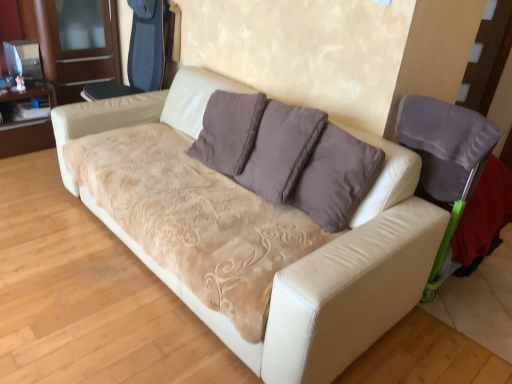
Question: From a real-world perspective, is brushed wood dresser at left over velvet purple armchair at right, which is the second armchair in back-to-front order?

Choices:
 (A) no
 (B) yes

Answer: (B)

Question: Can you confirm if brushed wood dresser at left is taller than velvet purple armchair at right, the first armchair viewed from the front?

Choices:
 (A) yes
 (B) no

Answer: (A)

Question: Is brushed wood dresser at left positioned in front of velvet purple armchair at right, the 2th armchair viewed from the top?

Choices:
 (A) yes
 (B) no

Answer: (B)

Question: Is velvet purple armchair at right, which is the 1th armchair in bottom-to-top order, at the back of brushed wood dresser at left?

Choices:
 (A) yes
 (B) no

Answer: (B)

Question: Is velvet purple armchair at right, which is the second armchair in back-to-front order, located within brushed wood dresser at left?

Choices:
 (A) no
 (B) yes

Answer: (A)

Question: Considering their positions, is white leather couch at center located in front of or behind brushed wood dresser at left?

Choices:
 (A) behind
 (B) front

Answer: (B)

Question: Is white leather couch at center wider or thinner than brushed wood dresser at left?

Choices:
 (A) wide
 (B) thin

Answer: (A)

Question: From the image's perspective, is white leather couch at center above or below brushed wood dresser at left?

Choices:
 (A) below
 (B) above

Answer: (A)

Question: Based on their sizes in the image, would you say white leather couch at center is bigger or smaller than brushed wood dresser at left?

Choices:
 (A) big
 (B) small

Answer: (A)

Question: Considering the positions of velvet purple armchair at right, the second armchair positioned from the left, and white leather couch at center in the image, is velvet purple armchair at right, the second armchair positioned from the left, taller or shorter than white leather couch at center?

Choices:
 (A) short
 (B) tall

Answer: (A)

Question: Choose the correct answer: Is velvet purple armchair at right, which is the 1th armchair in bottom-to-top order, inside white leather couch at center or outside it?

Choices:
 (A) outside
 (B) inside

Answer: (A)

Question: Is velvet purple armchair at right, which is the 1th armchair in bottom-to-top order, wider or thinner than white leather couch at center?

Choices:
 (A) wide
 (B) thin

Answer: (B)

Question: Is velvet purple armchair at right, the first armchair viewed from the front, to the left or to the right of white leather couch at center in the image?

Choices:
 (A) left
 (B) right

Answer: (B)

Question: Which is correct: velvet purple armchair at right, the 2th armchair viewed from the top, is inside brushed wood dresser at left, or outside of it?

Choices:
 (A) inside
 (B) outside

Answer: (B)

Question: Does point (423, 299) appear closer or farther from the camera than point (47, 26)?

Choices:
 (A) farther
 (B) closer

Answer: (B)